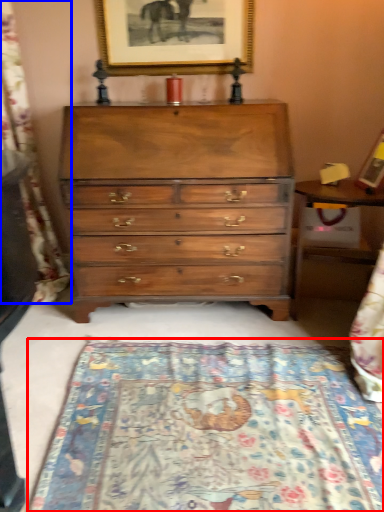
Question: Among these objects, which one is nearest to the camera, mat (highlighted by a red box) or tapestry (highlighted by a blue box)?

Choices:
 (A) mat
 (B) tapestry

Answer: (A)